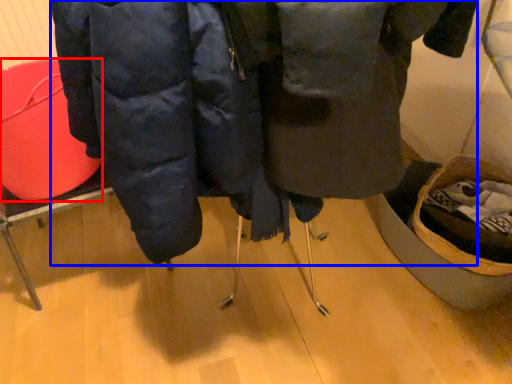
Question: Which of the following is the closest to the observer, basket (highlighted by a red box) or jacket (highlighted by a blue box)?

Choices:
 (A) basket
 (B) jacket

Answer: (B)